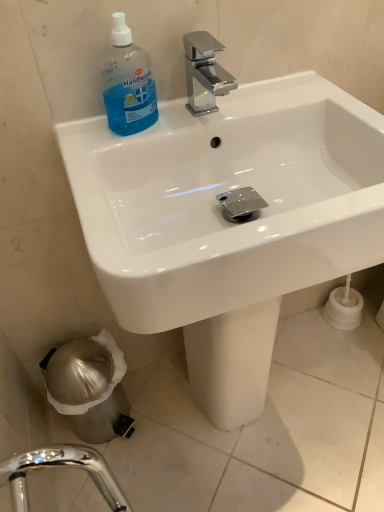
Question: From a real-world perspective, is white glossy sink at upper center positioned above or below blue translucent plastic handwash at upper left?

Choices:
 (A) below
 (B) above

Answer: (A)

Question: Considering the positions of white glossy sink at upper center and blue translucent plastic handwash at upper left in the image, is white glossy sink at upper center wider or thinner than blue translucent plastic handwash at upper left?

Choices:
 (A) wide
 (B) thin

Answer: (A)

Question: Considering the positions of white glossy sink at upper center and blue translucent plastic handwash at upper left in the image, is white glossy sink at upper center bigger or smaller than blue translucent plastic handwash at upper left?

Choices:
 (A) small
 (B) big

Answer: (B)

Question: In terms of size, does blue translucent plastic handwash at upper left appear bigger or smaller than white glossy sink at upper center?

Choices:
 (A) big
 (B) small

Answer: (B)

Question: Is blue translucent plastic handwash at upper left taller or shorter than white glossy sink at upper center?

Choices:
 (A) short
 (B) tall

Answer: (A)

Question: Is blue translucent plastic handwash at upper left situated inside white glossy sink at upper center or outside?

Choices:
 (A) inside
 (B) outside

Answer: (A)

Question: Based on their positions, is blue translucent plastic handwash at upper left located to the left or right of white glossy sink at upper center?

Choices:
 (A) left
 (B) right

Answer: (A)